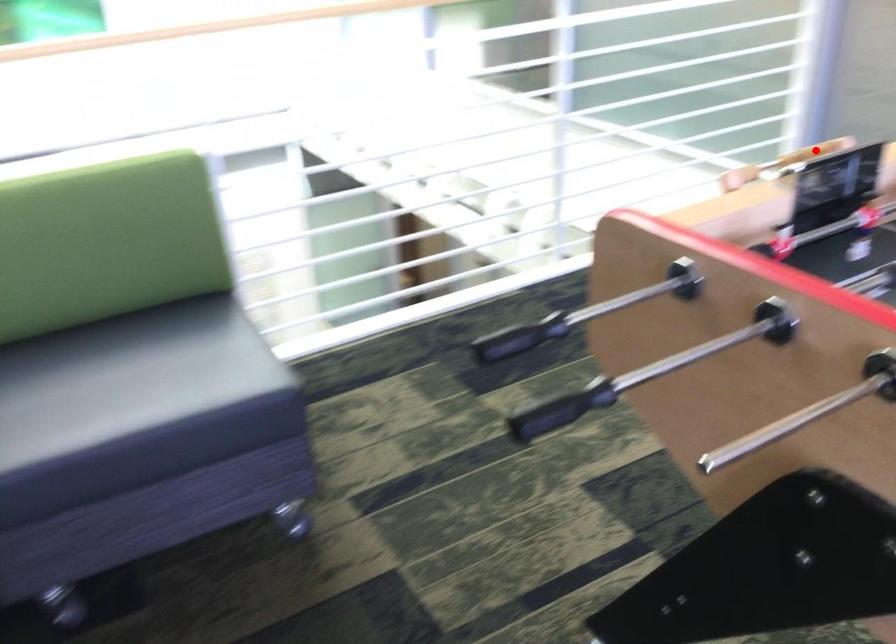
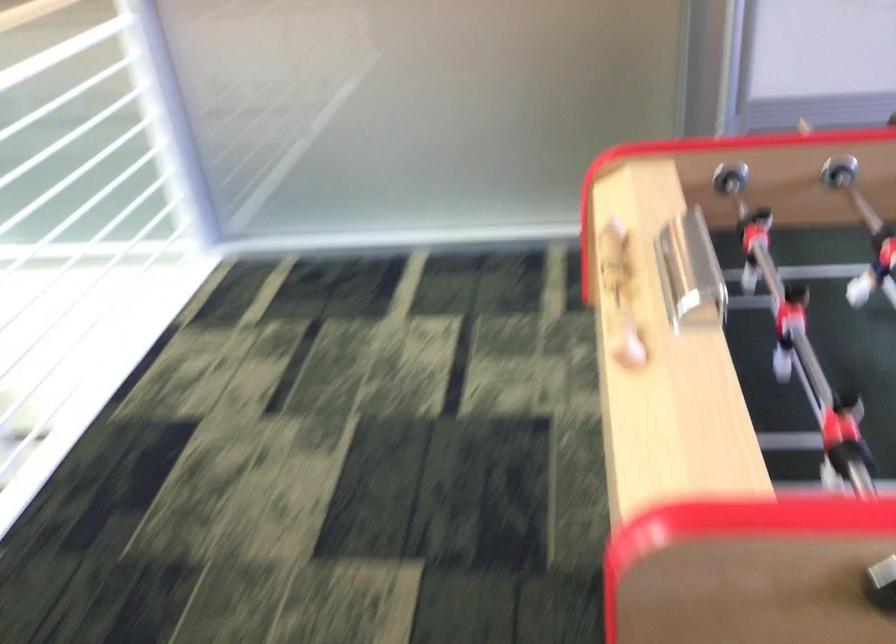
In the second image, find the point that corresponds to the highlighted location in the first image.

(614, 254)